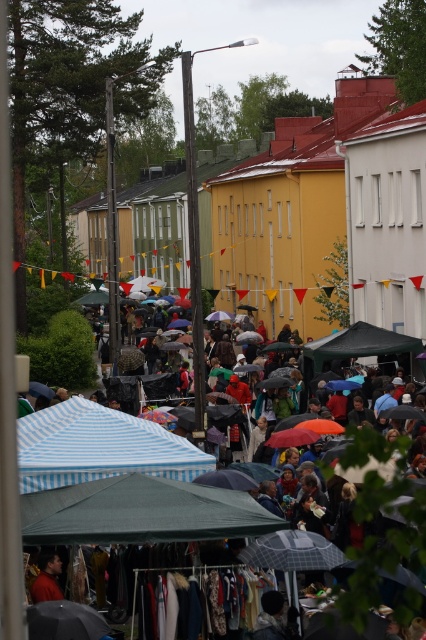
Question: Is green fabric canopy at lower center above matte black umbrella at lower left?

Choices:
 (A) no
 (B) yes

Answer: (B)

Question: Can you confirm if blue striped canopy at center is positioned to the right of black fabric canopy at center?

Choices:
 (A) yes
 (B) no

Answer: (B)

Question: Is green fabric canopy at lower center behind black fabric canopy at center?

Choices:
 (A) yes
 (B) no

Answer: (B)

Question: Which of these objects is positioned farthest from the matte red shirt at lower left?

Choices:
 (A) blue striped canopy at center
 (B) matte black umbrella at lower left

Answer: (A)

Question: Which of these objects is positioned farthest from the green fabric canopy at lower center?

Choices:
 (A) matte black umbrella at lower left
 (B) blue striped canopy at center

Answer: (B)

Question: Among these objects, which one is farthest from the camera?

Choices:
 (A) striped fabric tent at center
 (B) matte black umbrella at lower left
 (C) blue striped canopy at center
 (D) green fabric canopy at lower center

Answer: (C)